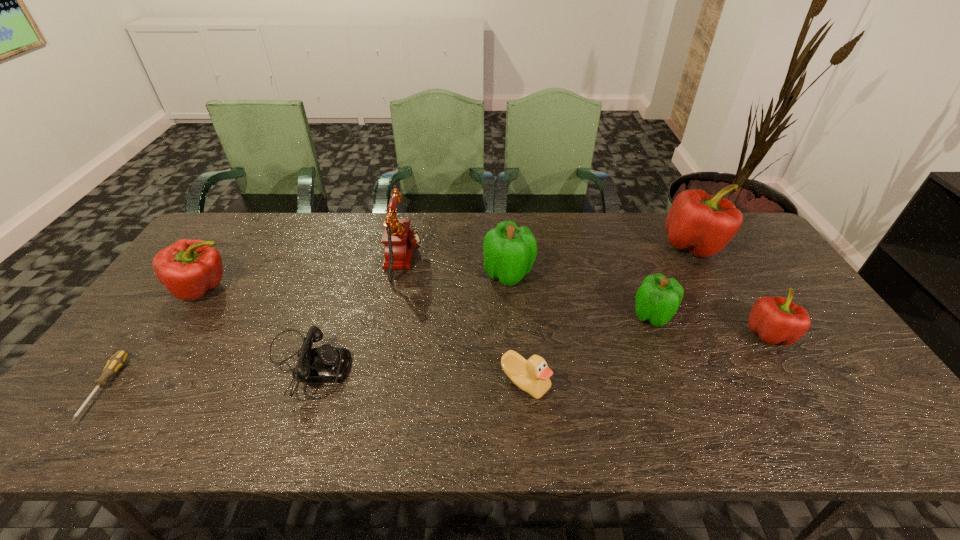
This screenshot has width=960, height=540. Identify the location of vacant position in the image that satisfies the following two spatial constraints: 1. on the dial of the taller telephone; 2. on the back side of the smallest pink bell pepper. (389, 334).

I want to click on free space in the image that satisfies the following two spatial constraints: 1. on the front side of the smaller green bell pepper; 2. on the front-facing side of the nearer telephone, so click(672, 366).

The width and height of the screenshot is (960, 540). I want to click on free region that satisfies the following two spatial constraints: 1. on the dial of the taller telephone; 2. on the right side of the left green bell pepper, so click(401, 274).

What are the coordinates of `free space that satisfies the following two spatial constraints: 1. on the front-facing side of the eighth tallest object; 2. at the tip of the shortest object` in the screenshot? It's located at (298, 388).